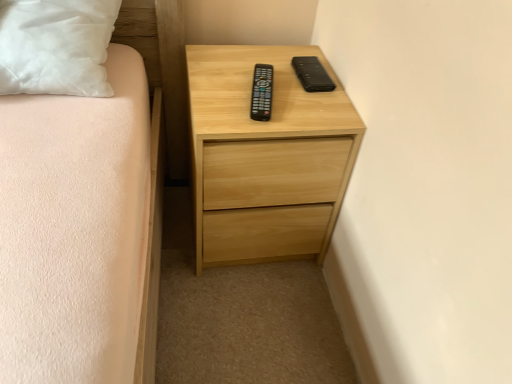
Locate an element on the screen. vacant space in front of black matte case at upper right is located at coordinates (308, 111).